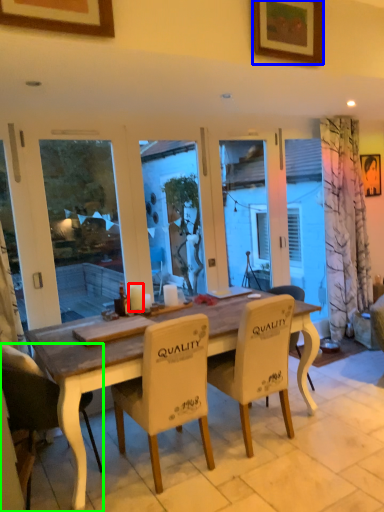
Question: Based on their relative distances, which object is nearer to candle (highlighted by a red box)? Choose from picture frame (highlighted by a blue box) and chair (highlighted by a green box).

Choices:
 (A) picture frame
 (B) chair

Answer: (B)